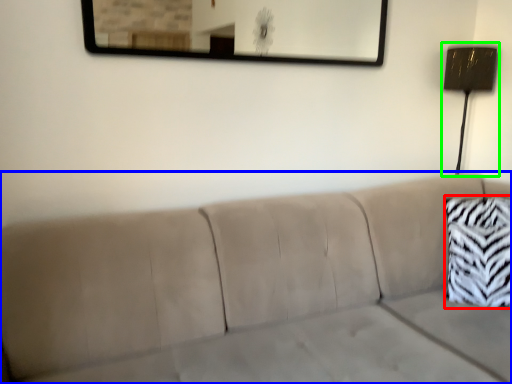
Question: Which object is the farthest from throw pillow (highlighted by a red box)? Choose among these: studio couch (highlighted by a blue box) or lamp (highlighted by a green box).

Choices:
 (A) studio couch
 (B) lamp

Answer: (B)